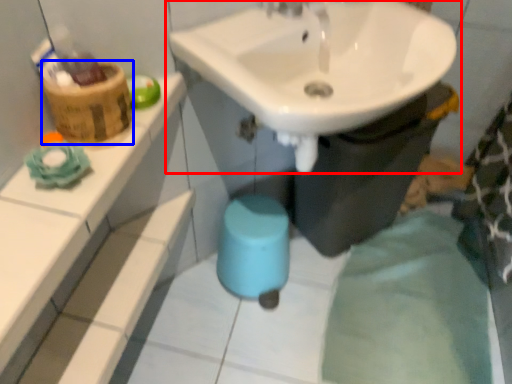
Question: Which object is closer to the camera taking this photo, sink (highlighted by a red box) or basket (highlighted by a blue box)?

Choices:
 (A) sink
 (B) basket

Answer: (A)